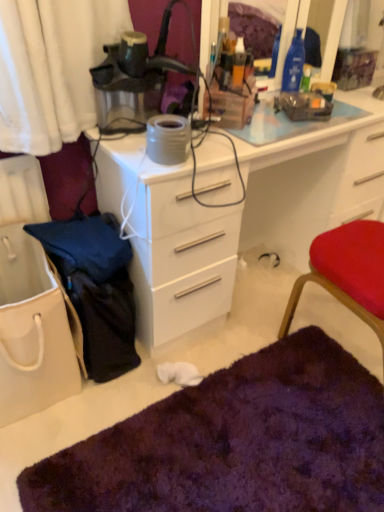
What do you see at coordinates (137, 78) in the screenshot?
I see `matte black lamp at upper center` at bounding box center [137, 78].

Measure the distance between matte gray coffee cup at upper right and camera.

They are 1.58 meters apart.

Image resolution: width=384 pixels, height=512 pixels. Describe the element at coordinates (32, 331) in the screenshot. I see `white canvas tote bag at lower left` at that location.

At what (x,y) coordinates should I click in order to perform the action: click on white glossy desk at center. Please return your answer as a coordinate pair (x, y). Looking at the image, I should click on (248, 217).

Is white glossy desk at center outside of clear glass mirror at upper center?

Yes, white glossy desk at center is outside of clear glass mirror at upper center.

Does white glossy desk at center have a lesser height compared to clear glass mirror at upper center?

No.

Between white glossy desk at center and clear glass mirror at upper center, which one is positioned in front?

white glossy desk at center.

Is point (211, 263) closer or farther from the camera than point (379, 42)?

Clearly, point (211, 263) is closer to the camera than point (379, 42).

Considering the sizes of white canvas tote bag at lower left and white glossy desk at center in the image, is white canvas tote bag at lower left taller or shorter than white glossy desk at center?

Clearly, white canvas tote bag at lower left is shorter compared to white glossy desk at center.

Is white canvas tote bag at lower left in contact with white glossy desk at center?

No, white canvas tote bag at lower left is not touching white glossy desk at center.

From a real-world perspective, which is physically below, white canvas tote bag at lower left or white glossy desk at center?

white canvas tote bag at lower left, from a real-world perspective.

Is white canvas tote bag at lower left situated inside white glossy desk at center or outside?

The correct answer is: outside.

Which object is further away from the camera taking this photo, matte black lamp at upper center or purple shaggy rug at lower center?

Positioned behind is matte black lamp at upper center.

Can you tell me how much matte black lamp at upper center and purple shaggy rug at lower center differ in facing direction?

There is a 91-degree angle between the facing directions of matte black lamp at upper center and purple shaggy rug at lower center.

Looking at this image, can you confirm if matte black lamp at upper center is positioned to the right of purple shaggy rug at lower center?

No, matte black lamp at upper center is not to the right of purple shaggy rug at lower center.

Considering the points (143, 44) and (208, 384), which point is behind, point (143, 44) or point (208, 384)?

The point (208, 384) is more distant.

The width and height of the screenshot is (384, 512). I want to click on mirror that appears above the matte gray coffee cup at upper right (from the image's perspective), so click(x=264, y=11).

From a real-world perspective, which is physically below, clear glass mirror at upper center or matte gray coffee cup at upper right?

matte gray coffee cup at upper right is physically lower.

Does clear glass mirror at upper center turn towards matte gray coffee cup at upper right?

Yes, clear glass mirror at upper center is aimed at matte gray coffee cup at upper right.

Is the depth of matte gray coffee cup at upper right less than that of white canvas tote bag at lower left?

No, the depth of matte gray coffee cup at upper right is greater than that of white canvas tote bag at lower left.

What's the angular difference between matte gray coffee cup at upper right and white canvas tote bag at lower left's facing directions?

20 degrees separate the facing orientations of matte gray coffee cup at upper right and white canvas tote bag at lower left.

Is matte gray coffee cup at upper right aimed at white canvas tote bag at lower left?

No, matte gray coffee cup at upper right does not turn towards white canvas tote bag at lower left.

Does matte black lamp at upper center have a lesser height compared to white canvas tote bag at lower left?

Indeed, matte black lamp at upper center has a lesser height compared to white canvas tote bag at lower left.

Is matte black lamp at upper center positioned far away from white canvas tote bag at lower left?

No, there isn't a large distance between matte black lamp at upper center and white canvas tote bag at lower left.

From a real-world perspective, who is located higher, matte black lamp at upper center or white canvas tote bag at lower left?

In real-world perspective, matte black lamp at upper center is above.

Is matte black lamp at upper center thinner than white canvas tote bag at lower left?

Indeed, matte black lamp at upper center has a lesser width compared to white canvas tote bag at lower left.

Is matte gray coffee cup at upper right at the back of matte black lamp at upper center?

matte black lamp at upper center does not have its back to matte gray coffee cup at upper right.

Based on the photo, does matte black lamp at upper center have a greater height compared to matte gray coffee cup at upper right?

Indeed, matte black lamp at upper center has a greater height compared to matte gray coffee cup at upper right.

In terms of size, does matte black lamp at upper center appear bigger or smaller than matte gray coffee cup at upper right?

Considering their sizes, matte black lamp at upper center takes up more space than matte gray coffee cup at upper right.

Where is `coffee cup that appears on the right of matte black lamp at upper center`? coffee cup that appears on the right of matte black lamp at upper center is located at coordinates (324, 89).

In order to click on desk on the left of the clear glass mirror at upper center in this screenshot , I will do `click(248, 217)`.

Where is `desk behind the white canvas tote bag at lower left`? desk behind the white canvas tote bag at lower left is located at coordinates (248, 217).

Based on their spatial positions, is white canvas tote bag at lower left or purple shaggy rug at lower center closer to matte black lamp at upper center?

Among the two, white canvas tote bag at lower left is located nearer to matte black lamp at upper center.

Estimate the real-world distances between objects in this image. Which object is closer to purple shaggy rug at lower center, matte black lamp at upper center or white glossy desk at center?

white glossy desk at center is closer to purple shaggy rug at lower center.

Based on their spatial positions, is white canvas tote bag at lower left or matte gray coffee cup at upper right further from white glossy desk at center?

Based on the image, white canvas tote bag at lower left appears to be further to white glossy desk at center.

When comparing their distances from white glossy desk at center, does matte black lamp at upper center or white canvas tote bag at lower left seem closer?

The object closer to white glossy desk at center is matte black lamp at upper center.

From the image, which object appears to be farther from clear glass mirror at upper center, purple shaggy rug at lower center or white glossy desk at center?

Based on the image, purple shaggy rug at lower center appears to be further to clear glass mirror at upper center.

Which object lies further to the anchor point white canvas tote bag at lower left, matte black lamp at upper center or matte gray coffee cup at upper right?

matte gray coffee cup at upper right.

Based on the photo, estimate the real-world distances between objects in this image. Which object is further from clear glass mirror at upper center, matte black lamp at upper center or white canvas tote bag at lower left?

white canvas tote bag at lower left lies further to clear glass mirror at upper center than the other object.

From the image, which object appears to be farther from purple shaggy rug at lower center, white canvas tote bag at lower left or white glossy desk at center?

white glossy desk at center is further to purple shaggy rug at lower center.

Image resolution: width=384 pixels, height=512 pixels. I want to click on coffee cup between clear glass mirror at upper center and white glossy desk at center from top to bottom, so click(x=324, y=89).

I want to click on handbag that lies between clear glass mirror at upper center and purple shaggy rug at lower center from top to bottom, so click(x=32, y=331).

Identify the location of desk that lies between clear glass mirror at upper center and purple shaggy rug at lower center from top to bottom. This screenshot has height=512, width=384. (248, 217).

This screenshot has height=512, width=384. I want to click on lamp between clear glass mirror at upper center and white canvas tote bag at lower left in the vertical direction, so click(137, 78).